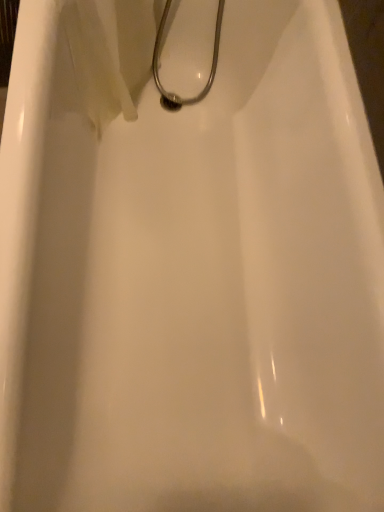
Where is `metallic hose at center`? The width and height of the screenshot is (384, 512). metallic hose at center is located at coordinates (211, 66).

What do you see at coordinates (211, 66) in the screenshot? I see `metallic hose at center` at bounding box center [211, 66].

Where is `metallic hose at center`? The height and width of the screenshot is (512, 384). metallic hose at center is located at coordinates (211, 66).